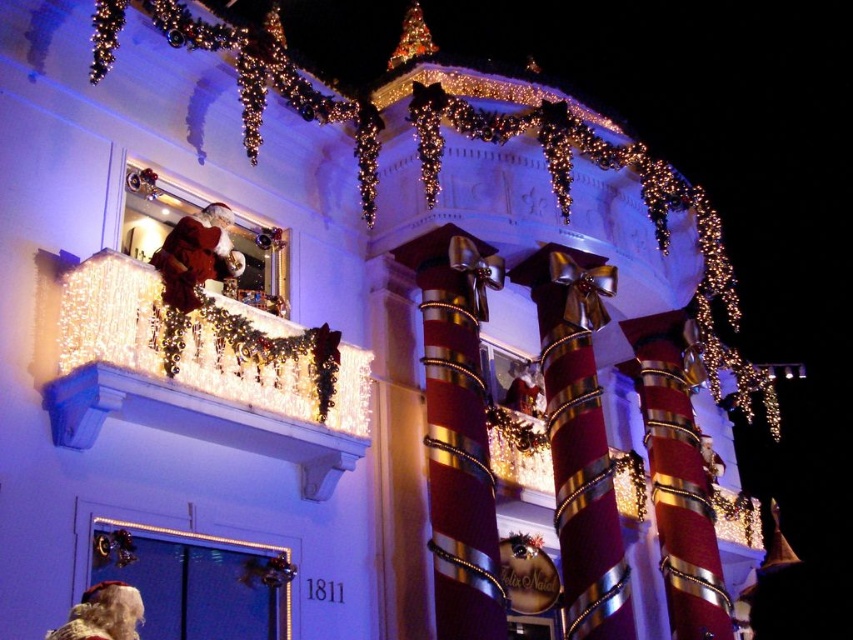
Question: Considering the relative positions of illuminated glass balcony at upper center and illuminated white lights at balcony left in the image provided, where is illuminated glass balcony at upper center located with respect to illuminated white lights at balcony left?

Choices:
 (A) above
 (B) below

Answer: (B)

Question: Can you confirm if illuminated glass balcony at upper center is wider than illuminated white lights at balcony left?

Choices:
 (A) no
 (B) yes

Answer: (A)

Question: Which point is closer to the camera?

Choices:
 (A) (154, 344)
 (B) (717, 273)

Answer: (A)

Question: Does illuminated glass balcony at upper center have a larger size compared to illuminated white lights at balcony left?

Choices:
 (A) no
 (B) yes

Answer: (A)

Question: Which object is farther from the camera taking this photo?

Choices:
 (A) illuminated white lights at balcony left
 (B) illuminated glass balcony at upper center

Answer: (A)

Question: Which point is farther to the camera?

Choices:
 (A) (643, 184)
 (B) (306, 396)

Answer: (A)